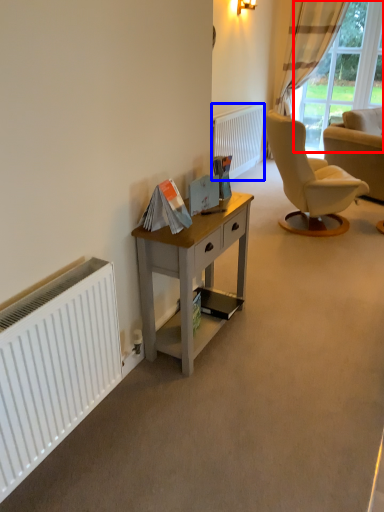
Question: Which of the following is the farthest to the observer, bay window (highlighted by a red box) or radiator (highlighted by a blue box)?

Choices:
 (A) bay window
 (B) radiator

Answer: (A)